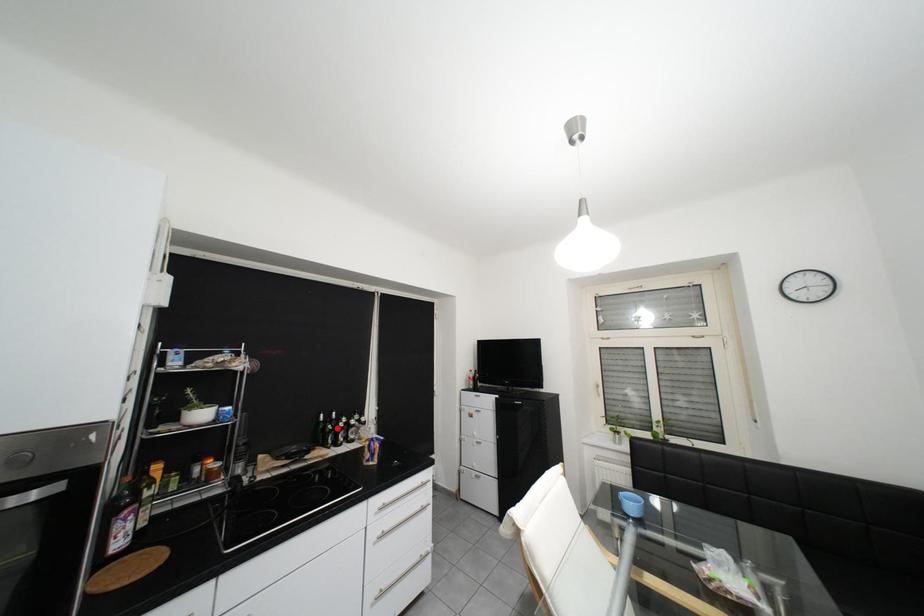
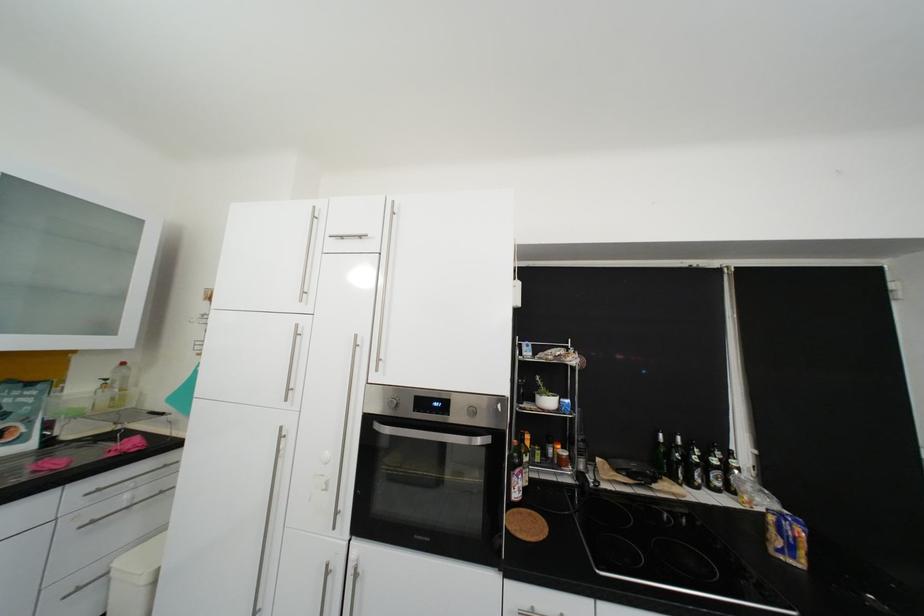
In the second image, find the point that corresponds to the highlighted location in the first image.

(682, 454)